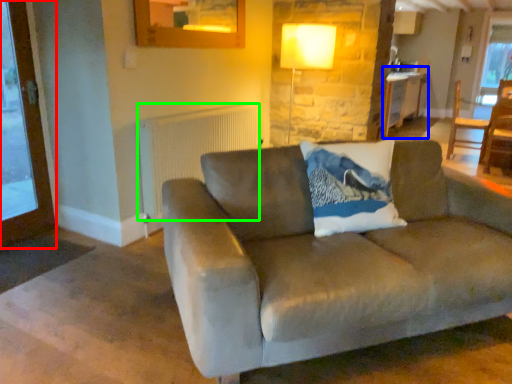
Question: Which object is the closest to the screen door (highlighted by a red box)? Choose among these: table (highlighted by a blue box) or radiator (highlighted by a green box).

Choices:
 (A) table
 (B) radiator

Answer: (B)